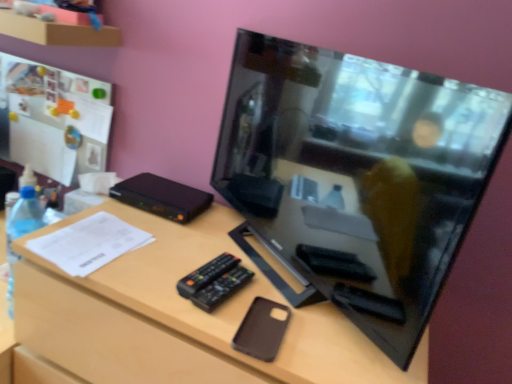
You are a GUI agent. You are given a task and a screenshot of the screen. Output one action in this format:
    pyautogui.click(x=<x>, y=<y>)
    Task: Click on the vacant space behind black plastic remote at center
    Image resolution: width=512 pixels, height=384 pixels.
    Given the screenshot: What is the action you would take?
    pyautogui.click(x=209, y=237)